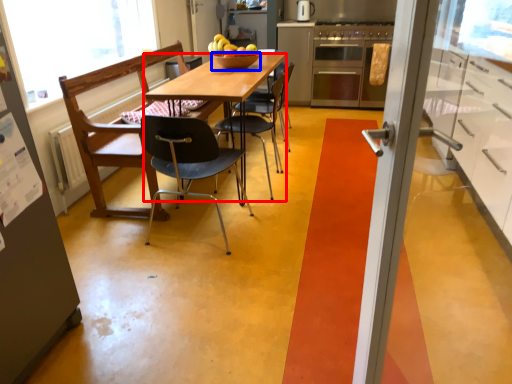
Question: Which object appears farthest to the camera in this image, desk (highlighted by a red box) or bowl (highlighted by a blue box)?

Choices:
 (A) desk
 (B) bowl

Answer: (B)